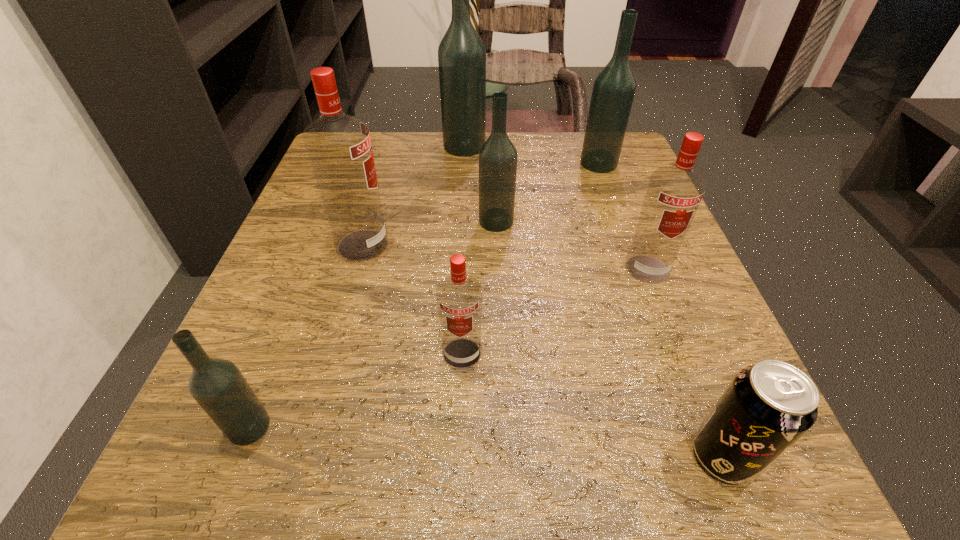
Identify the location of vodka located at the near edge. (217, 385).

The height and width of the screenshot is (540, 960). I want to click on soda can located at the near edge, so click(768, 406).

The width and height of the screenshot is (960, 540). Identify the location of soda can that is at the right edge. (768, 406).

The width and height of the screenshot is (960, 540). I want to click on object located in the near left corner section of the desktop, so click(x=217, y=385).

Locate an element on the screen. The image size is (960, 540). object at the far right corner is located at coordinates (614, 87).

You are a GUI agent. You are given a task and a screenshot of the screen. Output one action in this format:
    pyautogui.click(x=<x>, y=<y>)
    Task: Click on the object that is at the near right corner
    
    Given the screenshot: What is the action you would take?
    pyautogui.click(x=768, y=406)

The image size is (960, 540). I want to click on vacant position at the far edge of the desktop, so click(423, 135).

This screenshot has height=540, width=960. What are the coordinates of `vacant space at the near edge of the desktop` in the screenshot? It's located at (545, 443).

This screenshot has width=960, height=540. I want to click on free space at the left edge, so click(x=292, y=228).

At what (x,y) coordinates should I click in order to perform the action: click on free space at the right edge. Please return your answer as a coordinate pair (x, y). The width and height of the screenshot is (960, 540). Looking at the image, I should click on click(723, 360).